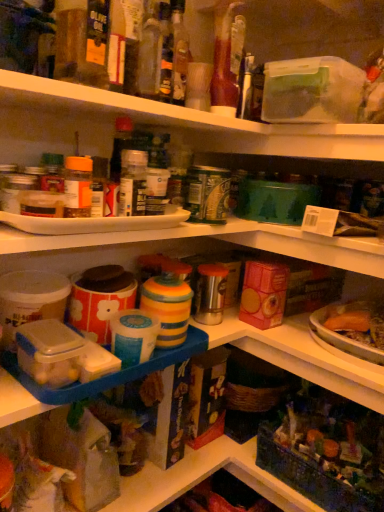
The width and height of the screenshot is (384, 512). I want to click on matte plastic bottle at center, the 4th bottle in the right-to-left sequence, so click(x=133, y=183).

Measure the distance between translucent glass bottle at upper center, which is counted as the 3th bottle, starting from the right, and camera.

translucent glass bottle at upper center, which is counted as the 3th bottle, starting from the right, is 27.72 inches from camera.

Describe the element at coordinates (224, 62) in the screenshot. This screenshot has height=512, width=384. I see `translucent glass bottle at upper center, acting as the first bottle starting from the right` at that location.

Find the location of `matte plastic bottle at center, the 4th bottle in the right-to-left sequence`. matte plastic bottle at center, the 4th bottle in the right-to-left sequence is located at coordinates (133, 183).

Does translucent glass bottle at upper center, the second bottle from the left, lie in front of translucent plastic container at lower right?

Yes, it is in front of translucent plastic container at lower right.

Considering the points (154, 1) and (303, 434), which point is behind, point (154, 1) or point (303, 434)?

The point (303, 434) is behind.

Considering the relative positions of translucent glass bottle at upper center, the second bottle from the left, and translucent plastic container at lower right in the image provided, is translucent glass bottle at upper center, the second bottle from the left, to the right of translucent plastic container at lower right from the viewer's perspective?

No.

Is translucent glass bottle at upper center, which is counted as the 3th bottle, starting from the right, positioned with its back to translucent plastic container at lower right?

No, translucent glass bottle at upper center, which is counted as the 3th bottle, starting from the right,'s orientation is not away from translucent plastic container at lower right.

Measure the distance from matte plastic bottle at center, which is the 1th bottle in left-to-right order, to translucent plastic container at lower right.

matte plastic bottle at center, which is the 1th bottle in left-to-right order, is 27.43 inches away from translucent plastic container at lower right.

Is matte plastic bottle at center, which is the 1th bottle in left-to-right order, oriented away from translucent plastic container at lower right?

No, matte plastic bottle at center, which is the 1th bottle in left-to-right order,'s orientation is not away from translucent plastic container at lower right.

Is matte plastic bottle at center, the 4th bottle in the right-to-left sequence, not near translucent plastic container at lower right?

They are positioned close to each other.

Is matte plastic bottle at center, the 4th bottle in the right-to-left sequence, at the right side of translucent plastic container at lower right?

In fact, matte plastic bottle at center, the 4th bottle in the right-to-left sequence, is to the left of translucent plastic container at lower right.

Is translucent plastic container at lower right thinner than translucent glass bottle at center, positioned as the 3th bottle in left-to-right order?

In fact, translucent plastic container at lower right might be wider than translucent glass bottle at center, positioned as the 3th bottle in left-to-right order.

Looking at this image, between translucent plastic container at lower right and translucent glass bottle at center, positioned as the 3th bottle in left-to-right order, which one has smaller size?

Smaller between the two is translucent glass bottle at center, positioned as the 3th bottle in left-to-right order.

From the image's perspective, does translucent plastic container at lower right appear higher than translucent glass bottle at center, which is the 2th bottle from right to left?

No, from the image's perspective, translucent plastic container at lower right is not above translucent glass bottle at center, which is the 2th bottle from right to left.

Does translucent plastic container at lower right touch translucent glass bottle at center, positioned as the 3th bottle in left-to-right order?

No, translucent plastic container at lower right is not making contact with translucent glass bottle at center, positioned as the 3th bottle in left-to-right order.

Is matte plastic bottle at center, which is the 1th bottle in left-to-right order, positioned with its back to translucent glass bottle at center, positioned as the 3th bottle in left-to-right order?

No, matte plastic bottle at center, which is the 1th bottle in left-to-right order,'s orientation is not away from translucent glass bottle at center, positioned as the 3th bottle in left-to-right order.

Considering the sizes of objects matte plastic bottle at center, which is the 1th bottle in left-to-right order, and translucent glass bottle at center, which is the 2th bottle from right to left, in the image provided, who is taller, matte plastic bottle at center, which is the 1th bottle in left-to-right order, or translucent glass bottle at center, which is the 2th bottle from right to left,?

translucent glass bottle at center, which is the 2th bottle from right to left.

From the picture: Does matte plastic bottle at center, which is the 1th bottle in left-to-right order, have a smaller size compared to translucent glass bottle at center, positioned as the 3th bottle in left-to-right order?

Indeed, matte plastic bottle at center, which is the 1th bottle in left-to-right order, has a smaller size compared to translucent glass bottle at center, positioned as the 3th bottle in left-to-right order.

Is matte plastic bottle at center, the 4th bottle in the right-to-left sequence, spatially inside translucent glass bottle at center, positioned as the 3th bottle in left-to-right order, or outside of it?

matte plastic bottle at center, the 4th bottle in the right-to-left sequence, is outside translucent glass bottle at center, positioned as the 3th bottle in left-to-right order.

Is translucent glass bottle at upper center, the fourth bottle in the left-to-right sequence, wider than matte plastic bottle at center, which is the 1th bottle in left-to-right order?

Yes.

From the matte plastic bottle at center, which is the 1th bottle in left-to-right order, count 3rd bottle to the right and point to it. Please provide its 2D coordinates.

[(224, 62)]

From a real-world perspective, between translucent glass bottle at upper center, the fourth bottle in the left-to-right sequence, and matte plastic bottle at center, the 4th bottle in the right-to-left sequence, who is vertically higher?

translucent glass bottle at upper center, the fourth bottle in the left-to-right sequence.

Is matte plastic bottle at center, the 4th bottle in the right-to-left sequence, inside translucent glass bottle at upper center, the fourth bottle in the left-to-right sequence?

No, matte plastic bottle at center, the 4th bottle in the right-to-left sequence, is not inside translucent glass bottle at upper center, the fourth bottle in the left-to-right sequence.

Is translucent glass bottle at center, positioned as the 3th bottle in left-to-right order, at the back of translucent glass bottle at upper center, the second bottle from the left?

That's not correct — translucent glass bottle at upper center, the second bottle from the left, is not looking away from translucent glass bottle at center, positioned as the 3th bottle in left-to-right order.

Is translucent glass bottle at upper center, which is counted as the 3th bottle, starting from the right, taller or shorter than translucent glass bottle at center, positioned as the 3th bottle in left-to-right order?

In the image, translucent glass bottle at upper center, which is counted as the 3th bottle, starting from the right, appears to be shorter than translucent glass bottle at center, positioned as the 3th bottle in left-to-right order.

Does translucent glass bottle at upper center, the second bottle from the left, lie in front of translucent glass bottle at center, which is the 2th bottle from right to left?

Yes, the depth of translucent glass bottle at upper center, the second bottle from the left, is less than that of translucent glass bottle at center, which is the 2th bottle from right to left.

Is translucent glass bottle at upper center, the second bottle from the left, in contact with translucent glass bottle at center, positioned as the 3th bottle in left-to-right order?

Yes, translucent glass bottle at upper center, the second bottle from the left, and translucent glass bottle at center, positioned as the 3th bottle in left-to-right order, clearly make contact.

From a real-world perspective, is translucent glass bottle at upper center, acting as the first bottle starting from the right, on translucent plastic container at lower right?

Correct, in the physical world, translucent glass bottle at upper center, acting as the first bottle starting from the right, is higher than translucent plastic container at lower right.

Between translucent glass bottle at upper center, the fourth bottle in the left-to-right sequence, and translucent plastic container at lower right, which one has smaller width?

translucent glass bottle at upper center, the fourth bottle in the left-to-right sequence, is thinner.

In the image, is translucent glass bottle at upper center, acting as the first bottle starting from the right, positioned in front of or behind translucent plastic container at lower right?

Visually, translucent glass bottle at upper center, acting as the first bottle starting from the right, is located in front of translucent plastic container at lower right.

From the image's perspective, is translucent glass bottle at upper center, acting as the first bottle starting from the right, located beneath translucent plastic container at lower right?

No, from the image's perspective, translucent glass bottle at upper center, acting as the first bottle starting from the right, is not below translucent plastic container at lower right.

At what (x,y) coordinates should I click in order to perform the action: click on food that is behind the translucent glass bottle at upper center, the second bottle from the left. Please return your answer as a coordinate pair (x, y). The width and height of the screenshot is (384, 512). Looking at the image, I should click on [x=335, y=441].

Locate an element on the screen. The height and width of the screenshot is (512, 384). food located underneath the matte plastic bottle at center, which is the 1th bottle in left-to-right order (from a real-world perspective) is located at coordinates (335, 441).

When comparing their distances from translucent glass bottle at upper center, the second bottle from the left, does translucent plastic container at lower right or matte plastic bottle at center, the 4th bottle in the right-to-left sequence, seem closer?

Based on the image, matte plastic bottle at center, the 4th bottle in the right-to-left sequence, appears to be nearer to translucent glass bottle at upper center, the second bottle from the left.

Estimate the real-world distances between objects in this image. Which object is further from translucent glass bottle at upper center, which is counted as the 3th bottle, starting from the right, translucent glass bottle at upper center, the fourth bottle in the left-to-right sequence, or translucent glass bottle at center, which is the 2th bottle from right to left?

translucent glass bottle at upper center, the fourth bottle in the left-to-right sequence, lies further to translucent glass bottle at upper center, which is counted as the 3th bottle, starting from the right, than the other object.

Estimate the real-world distances between objects in this image. Which object is further from translucent glass bottle at upper center, the second bottle from the left, translucent glass bottle at center, which is the 2th bottle from right to left, or matte plastic bottle at center, the 4th bottle in the right-to-left sequence?

The object further to translucent glass bottle at upper center, the second bottle from the left, is matte plastic bottle at center, the 4th bottle in the right-to-left sequence.

Based on their spatial positions, is matte plastic bottle at center, which is the 1th bottle in left-to-right order, or translucent plastic container at lower right further from translucent glass bottle at upper center, which is counted as the 3th bottle, starting from the right?

translucent plastic container at lower right lies further to translucent glass bottle at upper center, which is counted as the 3th bottle, starting from the right, than the other object.

From the image, which object appears to be nearer to translucent glass bottle at center, which is the 2th bottle from right to left, translucent plastic container at lower right or matte plastic bottle at center, which is the 1th bottle in left-to-right order?

matte plastic bottle at center, which is the 1th bottle in left-to-right order, is positioned closer to the anchor translucent glass bottle at center, which is the 2th bottle from right to left.

Based on their spatial positions, is translucent glass bottle at center, positioned as the 3th bottle in left-to-right order, or translucent plastic container at lower right closer to translucent glass bottle at upper center, which is counted as the 3th bottle, starting from the right?

Based on the image, translucent glass bottle at center, positioned as the 3th bottle in left-to-right order, appears to be nearer to translucent glass bottle at upper center, which is counted as the 3th bottle, starting from the right.

From the picture: Considering their positions, is translucent glass bottle at upper center, the second bottle from the left, positioned further to translucent glass bottle at upper center, the fourth bottle in the left-to-right sequence, than translucent plastic container at lower right?

Based on the image, translucent plastic container at lower right appears to be further to translucent glass bottle at upper center, the fourth bottle in the left-to-right sequence.

Based on their spatial positions, is translucent glass bottle at center, positioned as the 3th bottle in left-to-right order, or translucent glass bottle at upper center, which is counted as the 3th bottle, starting from the right, closer to matte plastic bottle at center, which is the 1th bottle in left-to-right order?

The object closer to matte plastic bottle at center, which is the 1th bottle in left-to-right order, is translucent glass bottle at upper center, which is counted as the 3th bottle, starting from the right.

I want to click on bottle between translucent glass bottle at upper center, which is counted as the 3th bottle, starting from the right, and translucent plastic container at lower right, in the vertical direction, so click(133, 183).

This screenshot has height=512, width=384. I want to click on bottle between translucent glass bottle at upper center, the second bottle from the left, and translucent glass bottle at upper center, acting as the first bottle starting from the right, in the horizontal direction, so click(179, 52).

I want to click on bottle between translucent glass bottle at upper center, the fourth bottle in the left-to-right sequence, and matte plastic bottle at center, the 4th bottle in the right-to-left sequence, vertically, so click(x=152, y=48).